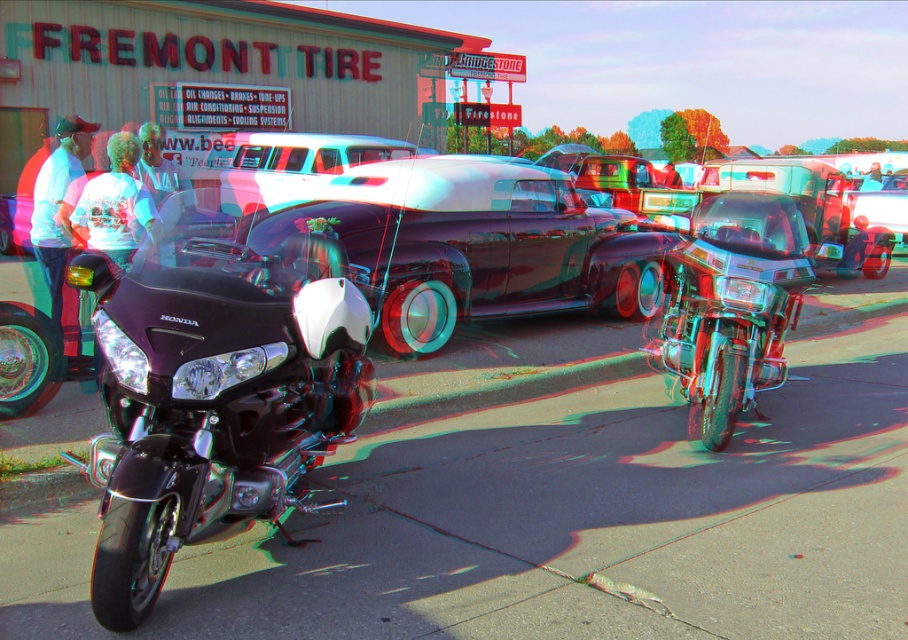
Does shiny black motorcycle at center have a greater height compared to light blue t-shirt at left?

Indeed, shiny black motorcycle at center has a greater height compared to light blue t-shirt at left.

Is point (132, 570) closer to viewer compared to point (53, 237)?

That is True.

This screenshot has width=908, height=640. I want to click on shiny black motorcycle at center, so click(216, 403).

In the scene shown: Who is more forward, (x=412, y=147) or (x=186, y=209)?

Positioned in front is point (x=186, y=209).

Is white glossy limousine at center taller than white t-shirt at center?

No.

The height and width of the screenshot is (640, 908). Find the location of `white glossy limousine at center`. white glossy limousine at center is located at coordinates (298, 164).

Does point (57, 168) come behind point (87, 182)?

Yes, point (57, 168) is farther from viewer.

Between light blue t-shirt at left and white cotton shirt at center, which one has less height?

light blue t-shirt at left is shorter.

Locate an element on the screen. The width and height of the screenshot is (908, 640). light blue t-shirt at left is located at coordinates (58, 205).